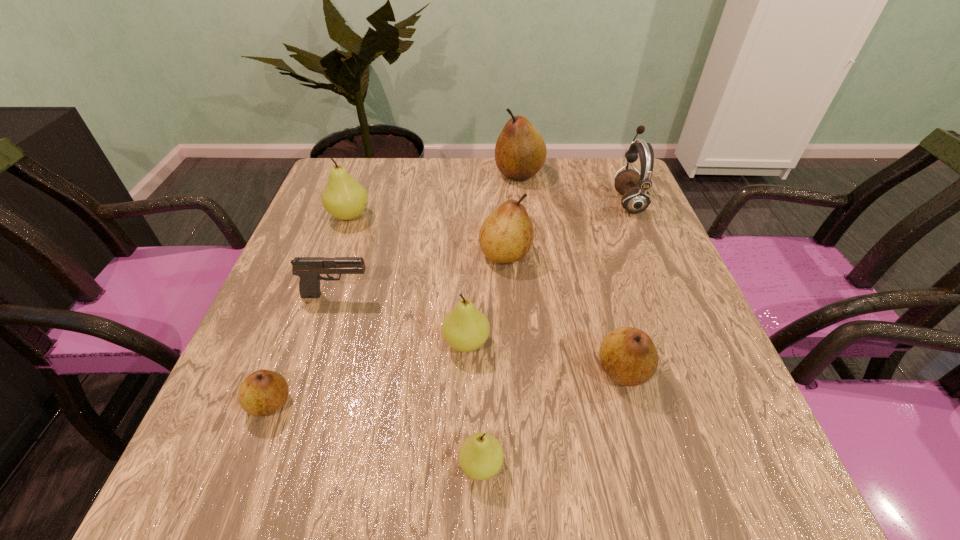
This screenshot has width=960, height=540. I want to click on the biggest brown pear, so click(520, 152).

Image resolution: width=960 pixels, height=540 pixels. I want to click on the farthest brown pear, so click(520, 152).

Identify the location of the rightmost object. This screenshot has width=960, height=540. (633, 185).

Where is `earphone`? earphone is located at coordinates (633, 185).

At what (x,y) coordinates should I click in order to perform the action: click on the biggest green pear. Please return your answer as a coordinate pair (x, y). Image resolution: width=960 pixels, height=540 pixels. Looking at the image, I should click on (344, 198).

Identify the location of the leftmost green pear. The width and height of the screenshot is (960, 540). (344, 198).

The width and height of the screenshot is (960, 540). I want to click on the fourth farthest object, so click(x=506, y=236).

In order to click on the third smallest brown pear in this screenshot , I will do (x=506, y=236).

You are a GUI agent. You are given a task and a screenshot of the screen. Output one action in this format:
    pyautogui.click(x=<x>, y=<y>)
    Task: Click on the second biggest green pear
    
    Given the screenshot: What is the action you would take?
    pyautogui.click(x=465, y=328)

Find the location of `the rightmost pear`. the rightmost pear is located at coordinates (628, 355).